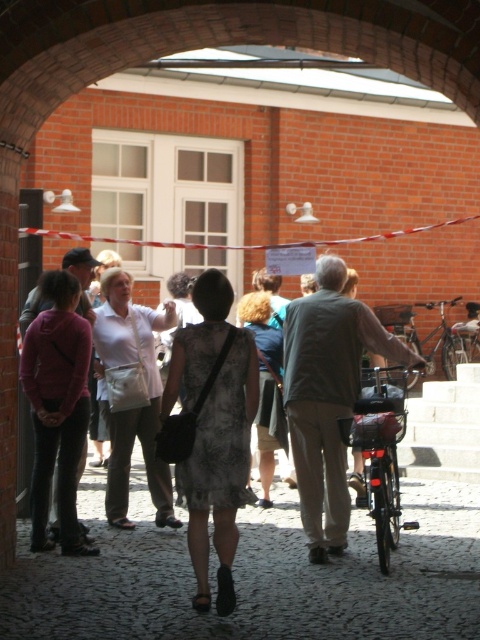
Question: Is floral dress at center above white fabric apron at center?

Choices:
 (A) no
 (B) yes

Answer: (A)

Question: Which is farther from the concrete staircase at center?

Choices:
 (A) shiny metallic bicycle at center
 (B) dark gray fabric jacket at center
 (C) floral dress at center

Answer: (C)

Question: Is dark gray fabric jacket at center further to camera compared to white fabric apron at center?

Choices:
 (A) yes
 (B) no

Answer: (B)

Question: Estimate the real-world distances between objects in this image. Which object is farther from the shiny metallic bicycle at center?

Choices:
 (A) white fabric apron at center
 (B) floral dress at center
 (C) matte gray dress at center
 (D) shiny black bicycle at center

Answer: (B)

Question: Which of the following is the farthest from the observer?

Choices:
 (A) (336, 461)
 (B) (383, 481)
 (C) (455, 413)

Answer: (C)

Question: Where is matte gray dress at center located in relation to shiny black bicycle at center in the image?

Choices:
 (A) right
 (B) left

Answer: (B)